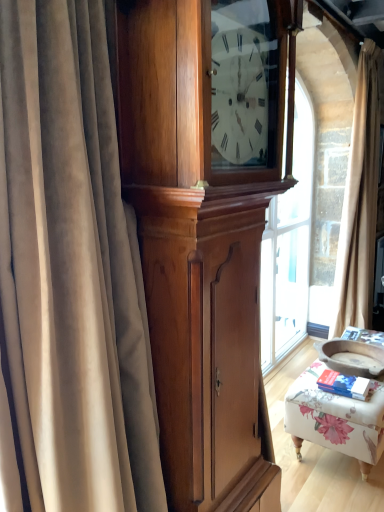
Question: From a real-world perspective, is beige velvet curtain at right, marked as the 1th curtain in a right-to-left arrangement, above or below polished wood cabinet at center?

Choices:
 (A) above
 (B) below

Answer: (A)

Question: From their relative heights in the image, would you say beige velvet curtain at right, the 2th curtain positioned from the front, is taller or shorter than polished wood cabinet at center?

Choices:
 (A) short
 (B) tall

Answer: (B)

Question: Considering the real-world distances, which object is closest to the floral fabric ottoman at lower right?

Choices:
 (A) polished wood cabinet at center
 (B) velvet curtain at left, positioned as the second curtain in back-to-front order
 (C) beige velvet curtain at right, the 2th curtain positioned from the front

Answer: (A)

Question: Estimate the real-world distances between objects in this image. Which object is closer to the beige velvet curtain at right, which ranks as the 2th curtain in left-to-right order?

Choices:
 (A) floral fabric ottoman at lower right
 (B) polished wood cabinet at center
 (C) velvet curtain at left, arranged as the first curtain when viewed from the left

Answer: (A)